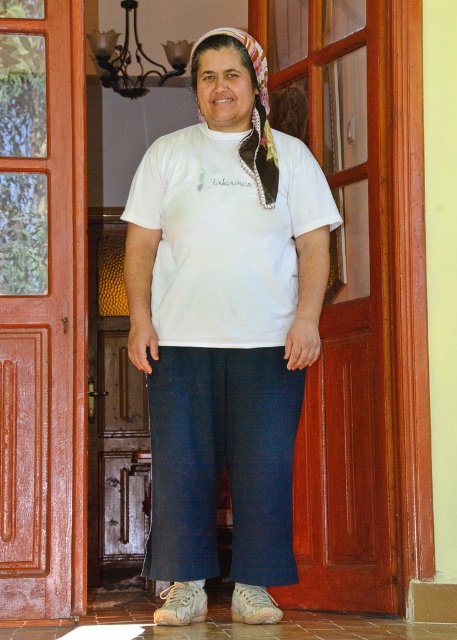
You are a delivery person who needs to leave a package at the correct address. You are looking at the image of the person standing in front of the door. According to the coordinates provided, where exactly is the white cotton shirt at center located in relation to the door?

The white cotton shirt at center is located at coordinates point (224,330), which is in the center of the image, directly in front of the door.